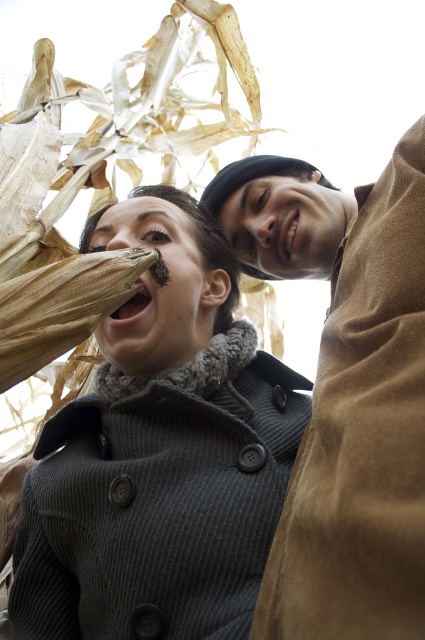
Question: Which object is the closest to the dark gray wool coat at center?

Choices:
 (A) brown textured corn at lower left
 (B) brown suede coat at upper right

Answer: (A)

Question: Is dark gray wool coat at center smaller than brown suede coat at upper right?

Choices:
 (A) no
 (B) yes

Answer: (A)

Question: Can you confirm if dark gray wool coat at center is positioned to the left of brown textured corn at lower left?

Choices:
 (A) no
 (B) yes

Answer: (A)

Question: Which object is positioned closest to the brown suede coat at upper right?

Choices:
 (A) dark gray wool coat at center
 (B) brown textured corn at lower left

Answer: (A)

Question: Can you confirm if brown suede coat at upper right is positioned below brown textured corn at lower left?

Choices:
 (A) yes
 (B) no

Answer: (A)

Question: Which point appears farthest from the camera in this image?

Choices:
 (A) (76, 285)
 (B) (280, 480)

Answer: (B)